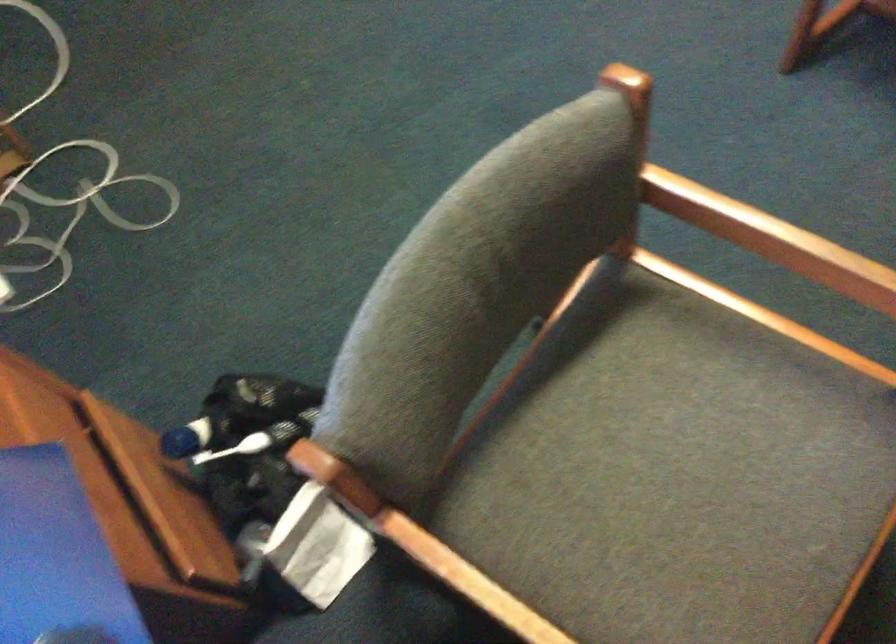
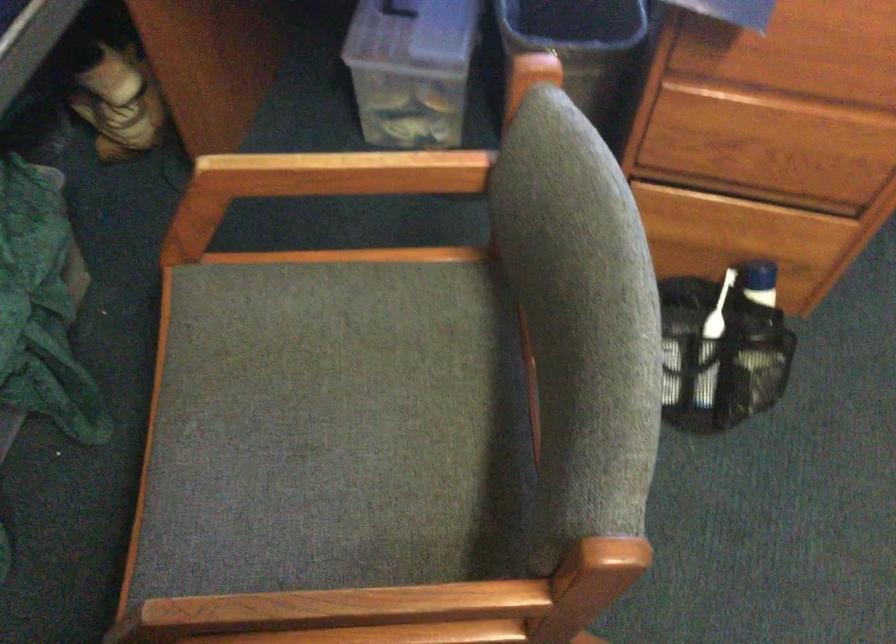
The point at (674,496) is marked in the first image. Where is the corresponding point in the second image?

(347, 406)